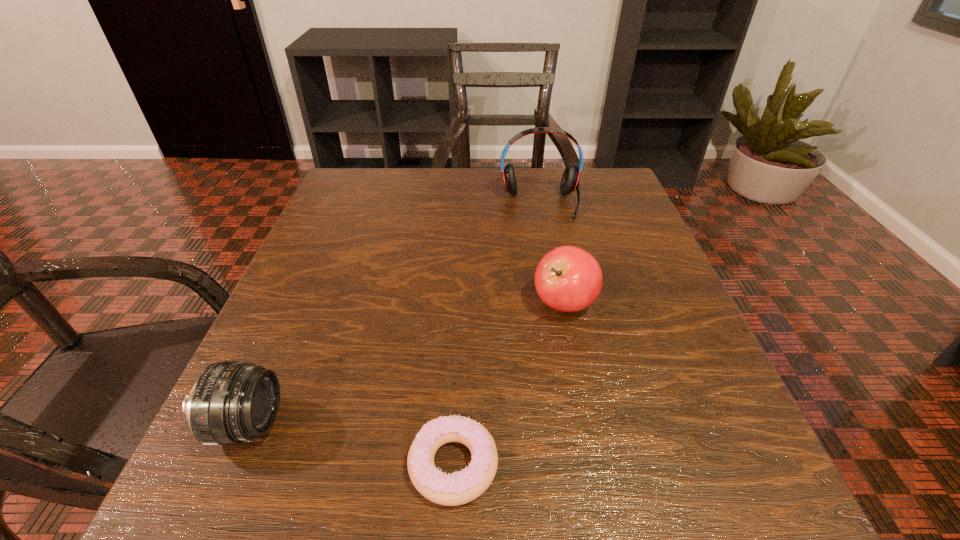
Locate an element on the screen. free space between the second farthest object and the telephoto lens is located at coordinates (406, 364).

Where is `vacant space that is in between the telephoto lens and the shortest object`? The width and height of the screenshot is (960, 540). vacant space that is in between the telephoto lens and the shortest object is located at coordinates (350, 444).

Find the location of a particular element. vacant area that lies between the third object from right to left and the telephoto lens is located at coordinates pos(350,444).

This screenshot has width=960, height=540. What are the coordinates of `object identified as the closest to the apple` in the screenshot? It's located at (459, 488).

Identify which object is the third closest to the headset. Please provide its 2D coordinates. Your answer should be formatted as a tuple, i.e. [(x, y)], where the tuple contains the x and y coordinates of a point satisfying the conditions above.

[(231, 402)]

The height and width of the screenshot is (540, 960). What are the coordinates of `free region that satisfies the following two spatial constraints: 1. with the microphone attached to the side of the headset; 2. at the front element of the telephoto lens` in the screenshot? It's located at (583, 424).

You are a GUI agent. You are given a task and a screenshot of the screen. Output one action in this format:
    pyautogui.click(x=<x>, y=<y>)
    Task: Click on the vacant area that satisfies the following two spatial constraints: 1. at the front element of the third object from right to left; 2. on the left side of the telephoto lens
    
    Given the screenshot: What is the action you would take?
    pyautogui.click(x=230, y=464)

The height and width of the screenshot is (540, 960). Find the location of `vacant space that satisfies the following two spatial constraints: 1. with the microphone attached to the side of the farthest object; 2. at the front element of the telephoto lens`. vacant space that satisfies the following two spatial constraints: 1. with the microphone attached to the side of the farthest object; 2. at the front element of the telephoto lens is located at coordinates (583, 424).

Where is `free point that satisfies the following two spatial constraints: 1. with the microphone attached to the side of the tallest object; 2. at the front element of the leftmost object`? This screenshot has height=540, width=960. free point that satisfies the following two spatial constraints: 1. with the microphone attached to the side of the tallest object; 2. at the front element of the leftmost object is located at coordinates pos(583,424).

You are a GUI agent. You are given a task and a screenshot of the screen. Output one action in this format:
    pyautogui.click(x=<x>, y=<y>)
    Task: Click on the vacant space that satisfies the following two spatial constraints: 1. on the front side of the apple; 2. at the front element of the leftmost object
    
    Given the screenshot: What is the action you would take?
    pyautogui.click(x=588, y=424)